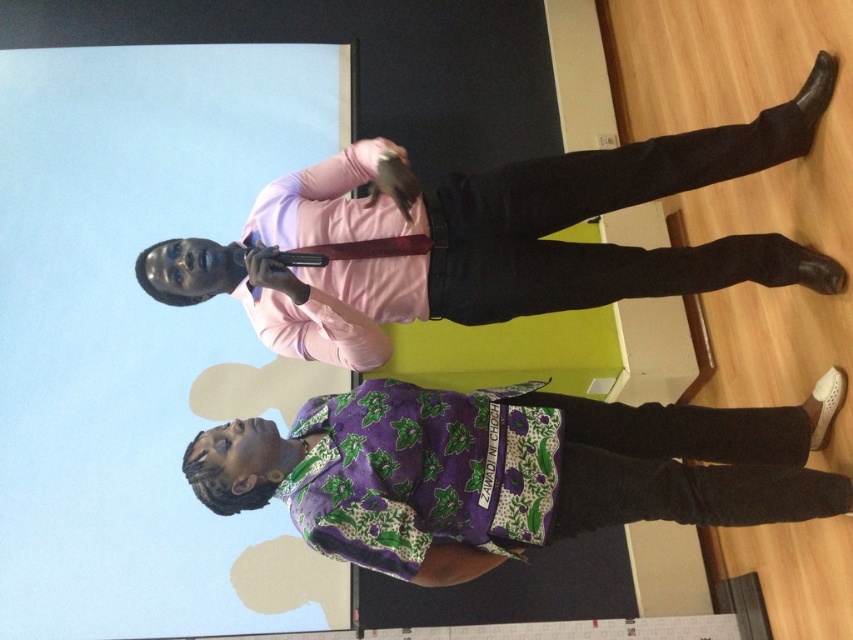
Question: Can you confirm if purple printed shirt at center is positioned to the left of purple batik dress at lower center?

Choices:
 (A) yes
 (B) no

Answer: (B)

Question: Which object is positioned farthest from the pink satin shirt at upper center?

Choices:
 (A) purple batik dress at lower center
 (B) purple printed shirt at center

Answer: (B)

Question: Which of the following is the farthest from the observer?

Choices:
 (A) (260, 289)
 (B) (410, 408)

Answer: (A)

Question: Which point is closer to the camera?

Choices:
 (A) (506, 528)
 (B) (349, 442)

Answer: (A)

Question: Does pink satin shirt at upper center have a lesser width compared to purple batik dress at lower center?

Choices:
 (A) no
 (B) yes

Answer: (A)

Question: Can you confirm if purple printed shirt at center is smaller than purple batik dress at lower center?

Choices:
 (A) yes
 (B) no

Answer: (B)